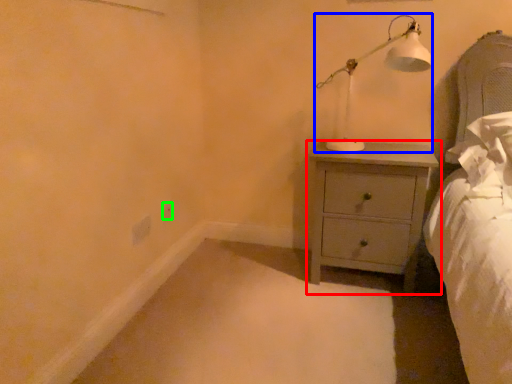
Question: Which object is the farthest from chest of drawers (highlighted by a red box)? Choose among these: table lamp (highlighted by a blue box) or electric outlet (highlighted by a green box).

Choices:
 (A) table lamp
 (B) electric outlet

Answer: (B)